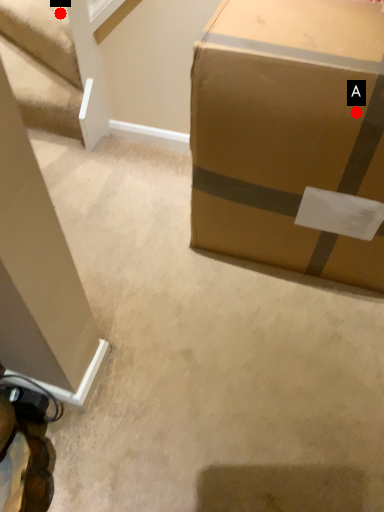
Question: Two points are circled on the image, labeled by A and B beside each circle. Which of the following is the farthest from the observer?

Choices:
 (A) A is further
 (B) B is further

Answer: (B)